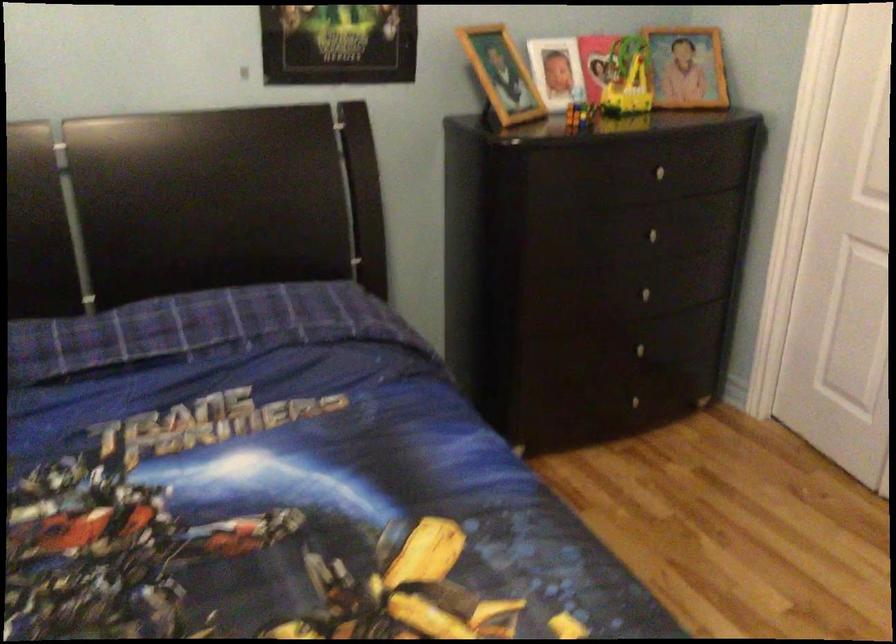
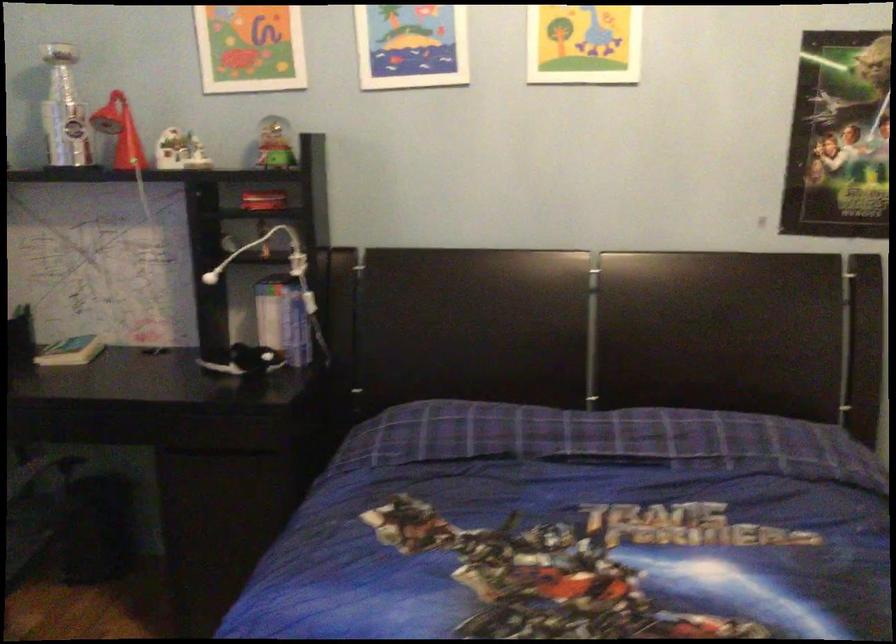
Question: How did the camera likely rotate?

Choices:
 (A) Left
 (B) Right
 (C) Up
 (D) Down

Answer: (A)